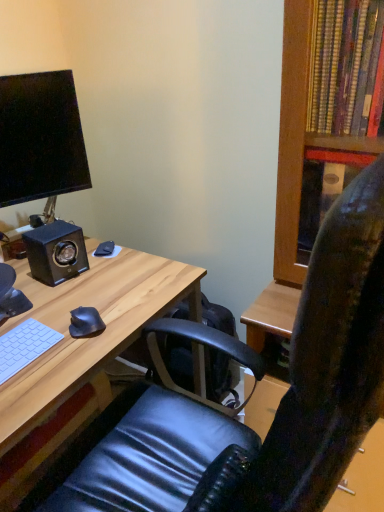
Locate an element on the screen. free area behind white matte keyboard at lower left is located at coordinates (44, 311).